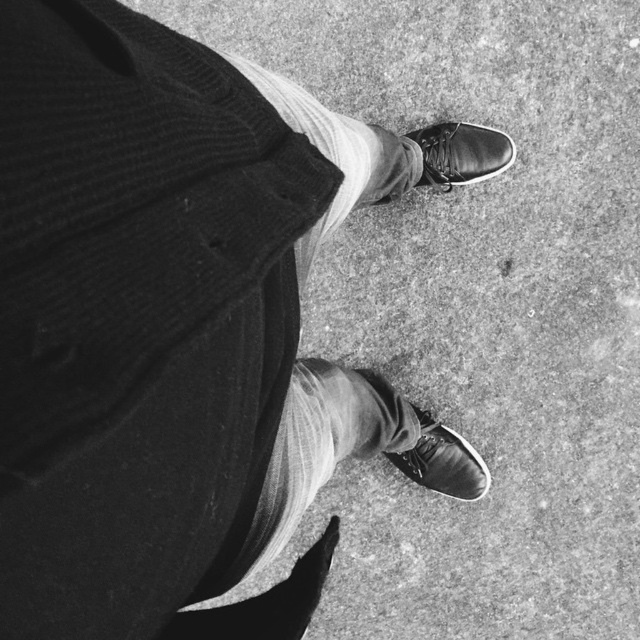
Does white textured sock at lower center lie behind shiny black shoe at center?

No, white textured sock at lower center is in front of shiny black shoe at center.

Is white textured sock at lower center above shiny black shoe at center?

Correct, white textured sock at lower center is located above shiny black shoe at center.

This screenshot has height=640, width=640. What do you see at coordinates (266, 602) in the screenshot?
I see `white textured sock at lower center` at bounding box center [266, 602].

At what (x,y) coordinates should I click in order to perform the action: click on white textured sock at lower center. Please return your answer as a coordinate pair (x, y). The image size is (640, 640). Looking at the image, I should click on (266, 602).

Between point (200, 618) and point (456, 173), which one is positioned in front?

Point (200, 618) is more forward.

This screenshot has width=640, height=640. Find the location of `white textured sock at lower center`. white textured sock at lower center is located at coordinates (266, 602).

At what (x,y) coordinates should I click in order to perform the action: click on white textured sock at lower center. Please return your answer as a coordinate pair (x, y). The height and width of the screenshot is (640, 640). Looking at the image, I should click on (266, 602).

From the picture: Is white textured sock at center above white textured sock at lower center?

Indeed, white textured sock at center is positioned over white textured sock at lower center.

Which of these two, white textured sock at center or white textured sock at lower center, stands taller?

With more height is white textured sock at center.

This screenshot has height=640, width=640. What do you see at coordinates (320, 140) in the screenshot? I see `white textured sock at center` at bounding box center [320, 140].

The height and width of the screenshot is (640, 640). Identify the location of white textured sock at center. (320, 140).